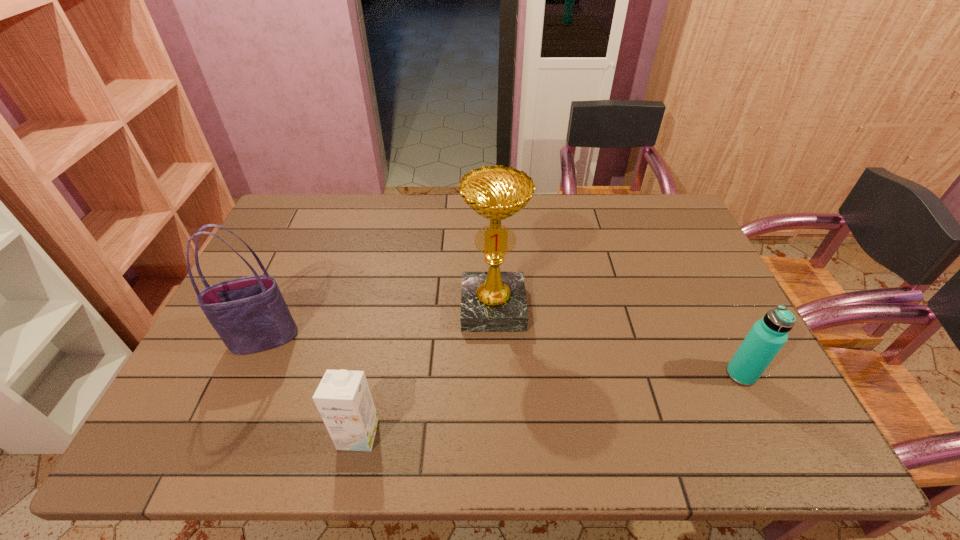
This screenshot has height=540, width=960. I want to click on object that is at the near edge, so click(x=343, y=398).

What are the coordinates of `object located at the left edge` in the screenshot? It's located at (250, 315).

Find the location of a particular element. This screenshot has height=540, width=960. object at the right edge is located at coordinates (767, 336).

At what (x,y) coordinates should I click in order to perform the action: click on vacant space at the far edge. Please return your answer as a coordinate pair (x, y). This screenshot has width=960, height=540. Looking at the image, I should click on (547, 221).

Where is `free space at the near edge`? The width and height of the screenshot is (960, 540). free space at the near edge is located at coordinates (532, 436).

Find the location of `vacant area at the right edge of the desktop`. vacant area at the right edge of the desktop is located at coordinates (684, 333).

The width and height of the screenshot is (960, 540). I want to click on free location at the far left corner, so click(310, 208).

Where is `free space between the nearest object and the rightmost object`? free space between the nearest object and the rightmost object is located at coordinates (550, 404).

At what (x,y) coordinates should I click in order to perform the action: click on empty space between the second nearest object and the second object from right to left. Please return your answer as a coordinate pair (x, y). Looking at the image, I should click on (617, 341).

Find the location of a particular element. Image resolution: width=960 pixels, height=540 pixels. vacant space that is in between the tote bag and the third object from right to left is located at coordinates (311, 387).